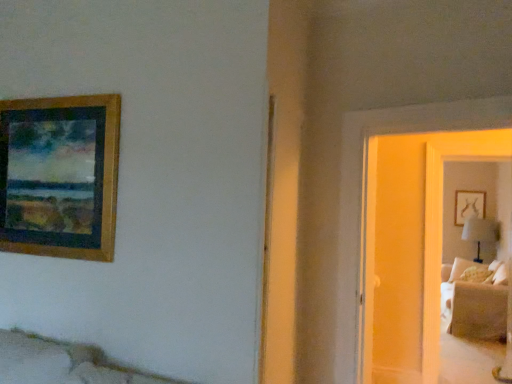
Question: Could white fabric table lamp at right be considered to be inside wooden picture frame at upper left?

Choices:
 (A) yes
 (B) no

Answer: (B)

Question: Considering the relative sizes of wooden picture frame at upper left and white fabric table lamp at right in the image provided, is wooden picture frame at upper left bigger than white fabric table lamp at right?

Choices:
 (A) yes
 (B) no

Answer: (B)

Question: Is wooden picture frame at upper left located outside white fabric table lamp at right?

Choices:
 (A) no
 (B) yes

Answer: (B)

Question: Does wooden picture frame at upper left have a greater width compared to white fabric table lamp at right?

Choices:
 (A) no
 (B) yes

Answer: (A)

Question: Is wooden picture frame at upper left not close to white fabric table lamp at right?

Choices:
 (A) no
 (B) yes

Answer: (B)

Question: Can you confirm if wooden picture frame at upper left is shorter than white fabric table lamp at right?

Choices:
 (A) yes
 (B) no

Answer: (B)

Question: Is matte glass door at right oriented towards wooden picture frame at upper left?

Choices:
 (A) no
 (B) yes

Answer: (A)

Question: Considering the relative sizes of matte glass door at right and wooden picture frame at upper left in the image provided, is matte glass door at right bigger than wooden picture frame at upper left?

Choices:
 (A) yes
 (B) no

Answer: (A)

Question: Considering the relative sizes of matte glass door at right and wooden picture frame at upper left in the image provided, is matte glass door at right taller than wooden picture frame at upper left?

Choices:
 (A) no
 (B) yes

Answer: (B)

Question: Is wooden picture frame at upper left completely or partially inside matte glass door at right?

Choices:
 (A) no
 (B) yes

Answer: (A)

Question: Is matte glass door at right positioned far away from wooden picture frame at upper left?

Choices:
 (A) no
 (B) yes

Answer: (B)

Question: Considering the relative sizes of matte glass door at right and wooden picture frame at upper left in the image provided, is matte glass door at right thinner than wooden picture frame at upper left?

Choices:
 (A) no
 (B) yes

Answer: (A)

Question: Does white fabric table lamp at right have a larger size compared to suede beige couch at right?

Choices:
 (A) no
 (B) yes

Answer: (A)